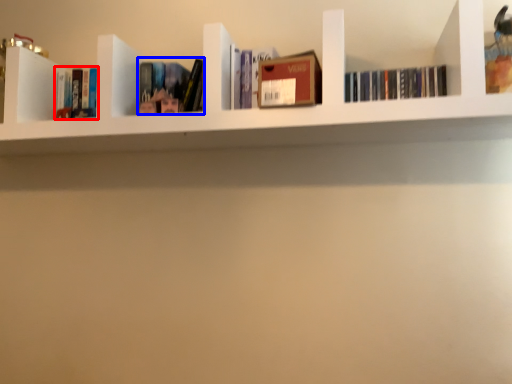
Question: Which of the following is the closest to the observer, book (highlighted by a red box) or book (highlighted by a blue box)?

Choices:
 (A) book
 (B) book

Answer: (B)